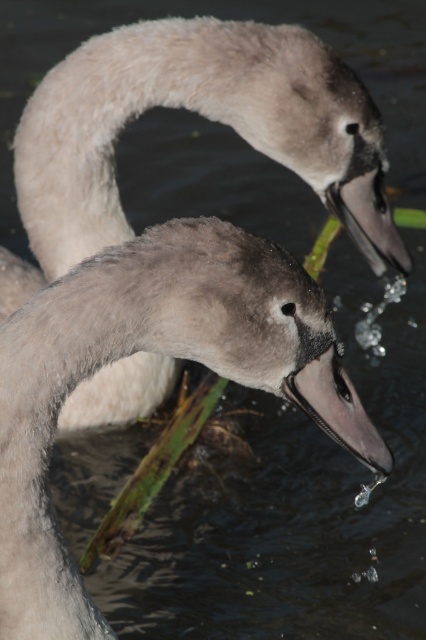
Question: Can you confirm if gray matte swan at center is positioned to the right of gray downy swan at center?

Choices:
 (A) no
 (B) yes

Answer: (A)

Question: In this image, where is gray matte swan at center located relative to gray downy swan at center?

Choices:
 (A) above
 (B) below

Answer: (B)

Question: Does gray matte swan at center have a smaller size compared to gray downy swan at center?

Choices:
 (A) yes
 (B) no

Answer: (A)

Question: Which of the following is the farthest from the observer?

Choices:
 (A) (146, 365)
 (B) (8, 547)

Answer: (A)